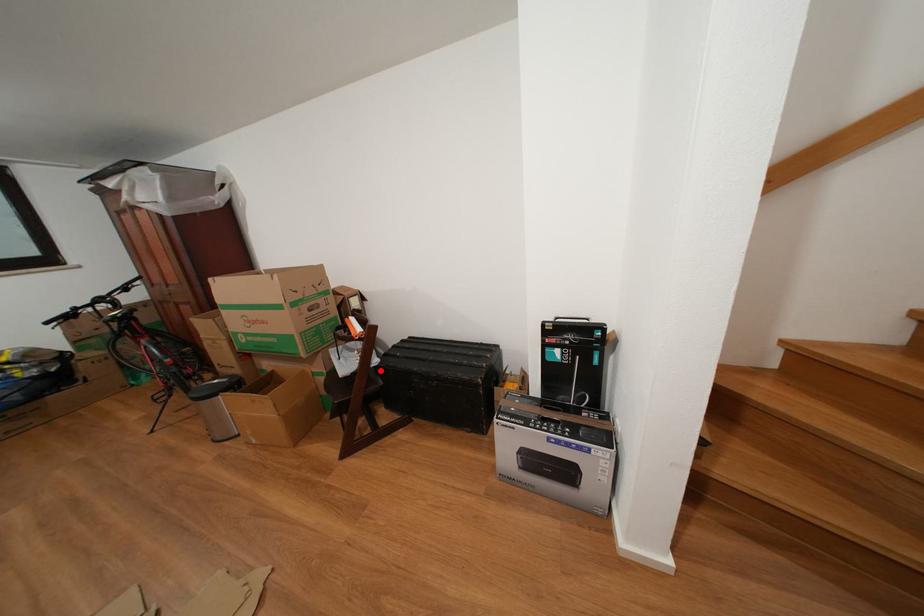
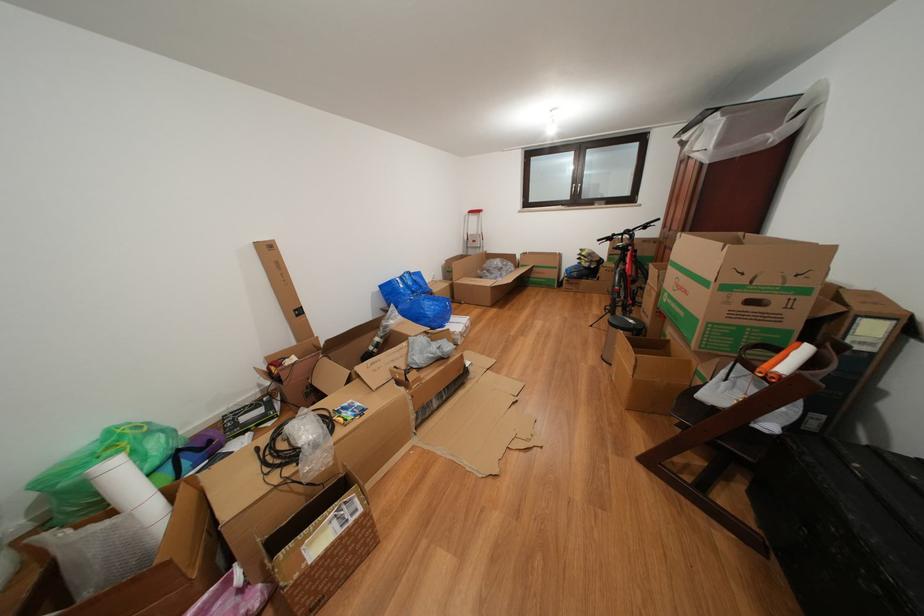
Find the pixel in the second image that matches the highlighted location in the first image.

(763, 431)